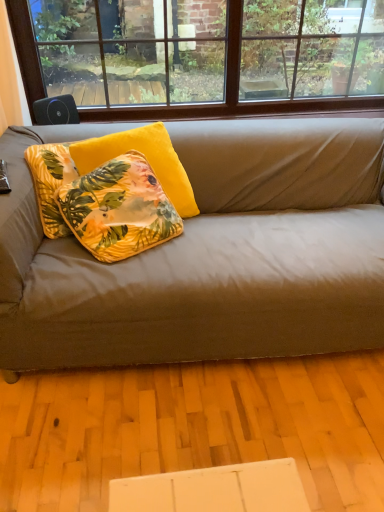
Question: Is brown wood window at upper center taller than floral yellow pillow at center, which ranks as the 1th pillow in front-to-back order?

Choices:
 (A) no
 (B) yes

Answer: (B)

Question: Does brown wood window at upper center have a larger size compared to floral yellow pillow at center, which ranks as the 2th pillow in back-to-front order?

Choices:
 (A) yes
 (B) no

Answer: (A)

Question: Is brown wood window at upper center facing away from floral yellow pillow at center, which ranks as the 2th pillow in back-to-front order?

Choices:
 (A) yes
 (B) no

Answer: (B)

Question: Is brown wood window at upper center further to camera compared to floral yellow pillow at center, which ranks as the 1th pillow in front-to-back order?

Choices:
 (A) no
 (B) yes

Answer: (B)

Question: Considering the relative sizes of brown wood window at upper center and floral yellow pillow at center, which ranks as the 1th pillow in front-to-back order, in the image provided, is brown wood window at upper center thinner than floral yellow pillow at center, which ranks as the 1th pillow in front-to-back order,?

Choices:
 (A) no
 (B) yes

Answer: (B)

Question: Considering the positions of yellow velvet pillow at center, placed as the 2th pillow when sorted from front to back, and matte gray couch at center in the image, is yellow velvet pillow at center, placed as the 2th pillow when sorted from front to back, wider or thinner than matte gray couch at center?

Choices:
 (A) wide
 (B) thin

Answer: (B)

Question: From the image's perspective, relative to matte gray couch at center, is yellow velvet pillow at center, placed as the 2th pillow when sorted from front to back, above or below?

Choices:
 (A) above
 (B) below

Answer: (A)

Question: From a real-world perspective, is yellow velvet pillow at center, placed as the 2th pillow when sorted from front to back, above or below matte gray couch at center?

Choices:
 (A) below
 (B) above

Answer: (B)

Question: Is yellow velvet pillow at center, placed as the 2th pillow when sorted from front to back, inside or outside of matte gray couch at center?

Choices:
 (A) outside
 (B) inside

Answer: (B)

Question: In terms of height, does brown wood window at upper center look taller or shorter compared to matte gray couch at center?

Choices:
 (A) tall
 (B) short

Answer: (B)

Question: From a real-world perspective, is brown wood window at upper center positioned above or below matte gray couch at center?

Choices:
 (A) above
 (B) below

Answer: (A)

Question: Looking at the image, does brown wood window at upper center seem bigger or smaller compared to matte gray couch at center?

Choices:
 (A) small
 (B) big

Answer: (A)

Question: Is point tap(259, 59) positioned closer to the camera than point tap(51, 333)?

Choices:
 (A) closer
 (B) farther

Answer: (B)

Question: In terms of width, does floral yellow pillow at center, which ranks as the 2th pillow in back-to-front order, look wider or thinner when compared to brown wood window at upper center?

Choices:
 (A) wide
 (B) thin

Answer: (A)

Question: Is floral yellow pillow at center, which ranks as the 1th pillow in front-to-back order, bigger or smaller than brown wood window at upper center?

Choices:
 (A) big
 (B) small

Answer: (B)